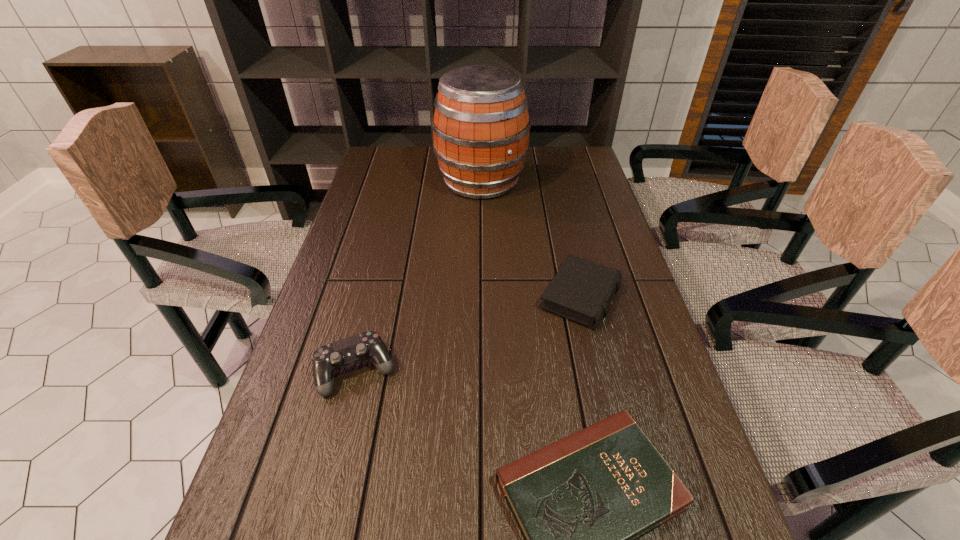
The width and height of the screenshot is (960, 540). I want to click on object that is positioned at the left edge, so click(327, 359).

The width and height of the screenshot is (960, 540). I want to click on object present at the right edge, so click(582, 290).

Where is `free spot at the left edge of the desktop`? free spot at the left edge of the desktop is located at coordinates (291, 526).

You are a GUI agent. You are given a task and a screenshot of the screen. Output one action in this format:
    pyautogui.click(x=<x>, y=<y>)
    Task: Click on the vacant point at the right edge
    The image size is (960, 540).
    Given the screenshot: What is the action you would take?
    click(609, 259)

At what (x,y) coordinates should I click in order to perform the action: click on vacant space at the far left corner of the desktop. Please return your answer as a coordinate pair (x, y). The height and width of the screenshot is (540, 960). Looking at the image, I should click on (389, 146).

Find the location of a particular element. free point between the tallest object and the leftmost object is located at coordinates (419, 276).

At what (x,y) coordinates should I click in order to perform the action: click on vacant area that lies between the taller Bible and the cider. Please return your answer as a coordinate pair (x, y). The image size is (960, 540). Looking at the image, I should click on (531, 239).

Where is `unoccupied area between the farthest object and the second farthest object`? This screenshot has height=540, width=960. unoccupied area between the farthest object and the second farthest object is located at coordinates (531, 239).

Locate an element on the screen. The width and height of the screenshot is (960, 540). unoccupied position between the farthest object and the third nearest object is located at coordinates (531, 239).

Find the location of `the third closest object to the third tallest object`. the third closest object to the third tallest object is located at coordinates (327, 359).